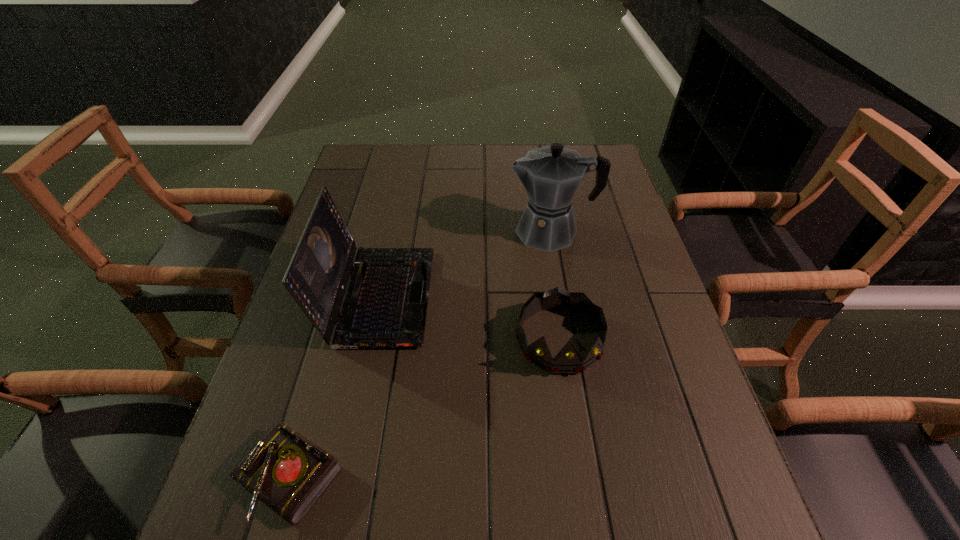
Locate an element on the screen. The width and height of the screenshot is (960, 540). free spot located at the front of the third tallest object with jewels is located at coordinates (578, 465).

Where is `blank space located on the right of the nearest object`? blank space located on the right of the nearest object is located at coordinates (424, 478).

Find the location of a particular element. object that is at the near edge is located at coordinates click(x=289, y=473).

The height and width of the screenshot is (540, 960). I want to click on laptop computer present at the left edge, so click(385, 306).

In order to click on diary positioned at the left edge in this screenshot , I will do point(289,473).

Where is `object that is at the right edge`? Image resolution: width=960 pixels, height=540 pixels. object that is at the right edge is located at coordinates [x=551, y=175].

This screenshot has width=960, height=540. In order to click on object present at the near left corner in this screenshot , I will do `click(289, 473)`.

Identify the location of vacant region at the far edge. pyautogui.click(x=436, y=149).

I want to click on free space at the near edge of the desktop, so click(399, 532).

You are a GUI agent. You are given a task and a screenshot of the screen. Output one action in this format:
    pyautogui.click(x=<x>, y=<y>)
    Task: Click on the vacant space at the right edge of the desktop
    This screenshot has height=540, width=960.
    Given the screenshot: What is the action you would take?
    pyautogui.click(x=598, y=244)